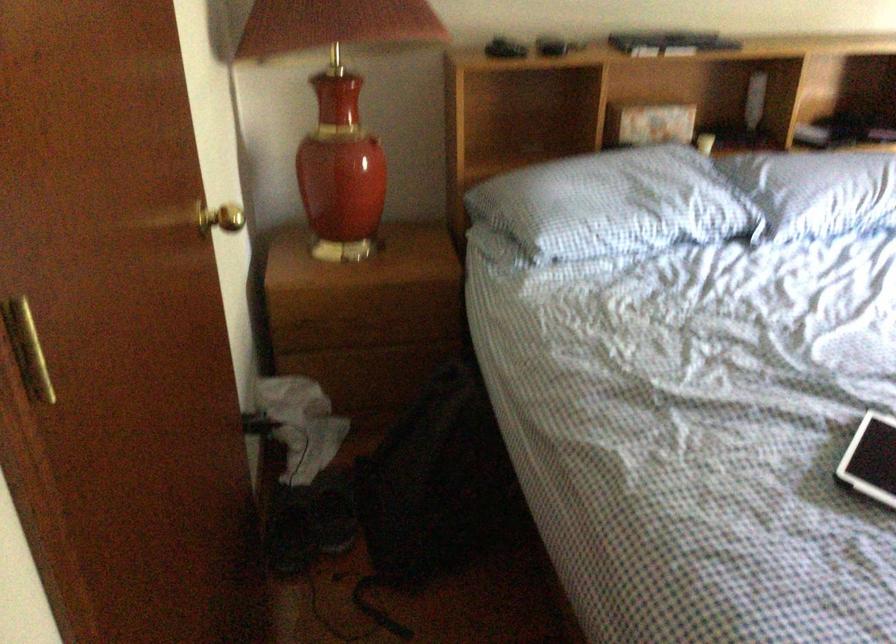
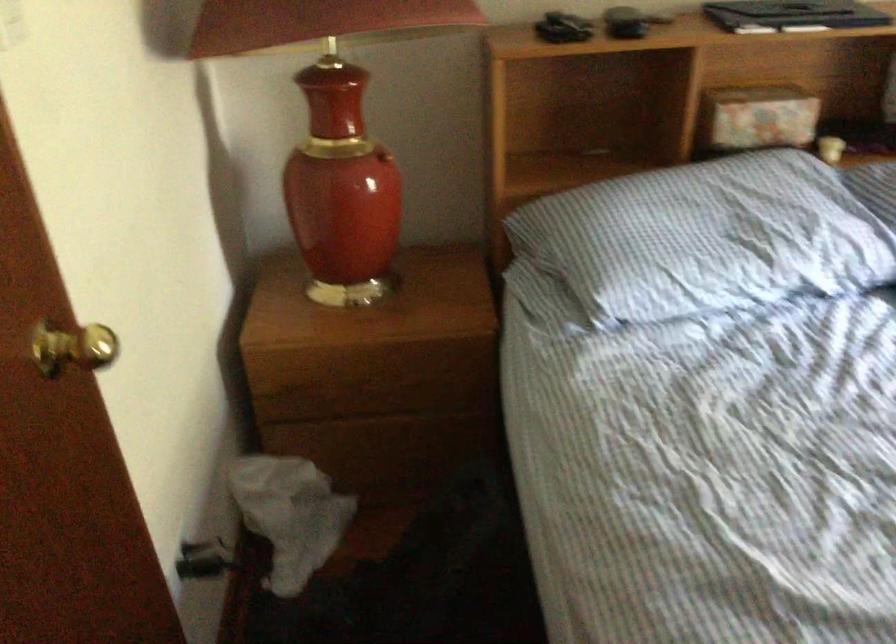
The point at (x=615, y=200) is marked in the first image. Where is the corresponding point in the second image?

(707, 238)